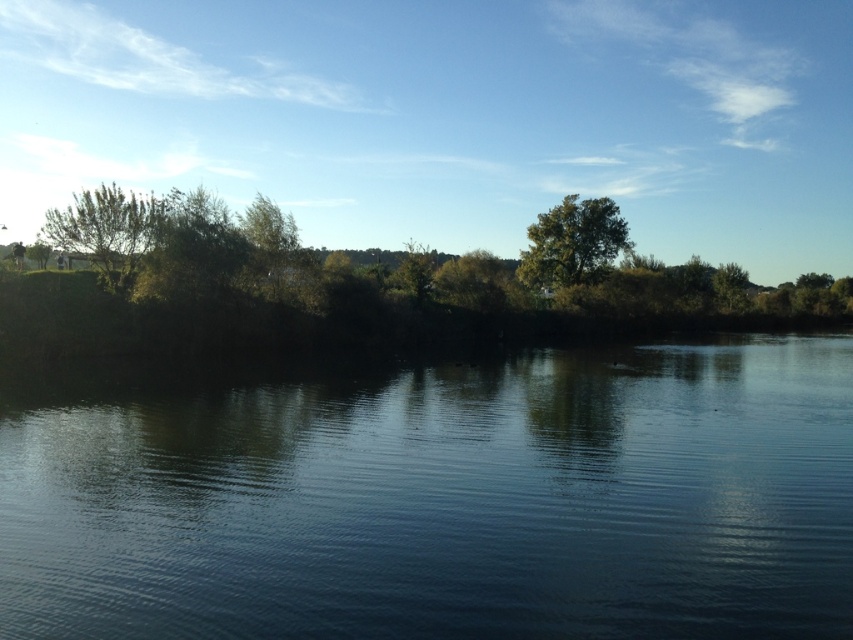
Question: Which point is closer to the camera?

Choices:
 (A) dark blue water at center
 (B) green leafy tree at center

Answer: (A)

Question: Among these objects, which one is nearest to the camera?

Choices:
 (A) green leafy tree at left
 (B) dark blue water at center

Answer: (B)

Question: Can you confirm if dark blue water at center is positioned above green leafy tree at center?

Choices:
 (A) no
 (B) yes

Answer: (A)

Question: Is green leafy tree at left thinner than green leafy tree at center?

Choices:
 (A) no
 (B) yes

Answer: (A)

Question: Does green leafy tree at left have a smaller size compared to green leafy tree at center?

Choices:
 (A) yes
 (B) no

Answer: (B)

Question: Which object is farther from the camera taking this photo?

Choices:
 (A) green leafy tree at center
 (B) dark blue water at center

Answer: (A)